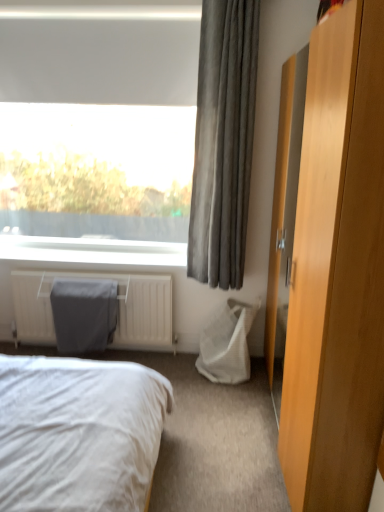
Question: Is white fabric bed at lower left oriented towards matte fabric radiator cover at lower left?

Choices:
 (A) yes
 (B) no

Answer: (B)

Question: Is white fabric bed at lower left outside matte fabric radiator cover at lower left?

Choices:
 (A) yes
 (B) no

Answer: (A)

Question: Can you confirm if white fabric bed at lower left is bigger than matte fabric radiator cover at lower left?

Choices:
 (A) yes
 (B) no

Answer: (A)

Question: Is white fabric bed at lower left at the left side of matte fabric radiator cover at lower left?

Choices:
 (A) yes
 (B) no

Answer: (B)

Question: Considering the relative sizes of white fabric bed at lower left and matte fabric radiator cover at lower left in the image provided, is white fabric bed at lower left thinner than matte fabric radiator cover at lower left?

Choices:
 (A) no
 (B) yes

Answer: (A)

Question: Would you say matte fabric radiator cover at lower left is part of white fabric bed at lower left's contents?

Choices:
 (A) no
 (B) yes

Answer: (A)

Question: From a real-world perspective, does light brown wood dresser at right sit lower than gray fabric curtain at upper right?

Choices:
 (A) no
 (B) yes

Answer: (B)

Question: Is the depth of light brown wood dresser at right less than that of gray fabric curtain at upper right?

Choices:
 (A) yes
 (B) no

Answer: (A)

Question: Is gray fabric curtain at upper right completely or partially inside light brown wood dresser at right?

Choices:
 (A) yes
 (B) no

Answer: (B)

Question: From a real-world perspective, is light brown wood dresser at right over gray fabric curtain at upper right?

Choices:
 (A) no
 (B) yes

Answer: (A)

Question: Would you say light brown wood dresser at right is a long distance from gray fabric curtain at upper right?

Choices:
 (A) no
 (B) yes

Answer: (B)

Question: From the image's perspective, is light brown wood dresser at right located above gray fabric curtain at upper right?

Choices:
 (A) no
 (B) yes

Answer: (A)

Question: Can you confirm if gray fabric curtain at upper right is bigger than matte fabric radiator cover at lower left?

Choices:
 (A) yes
 (B) no

Answer: (A)